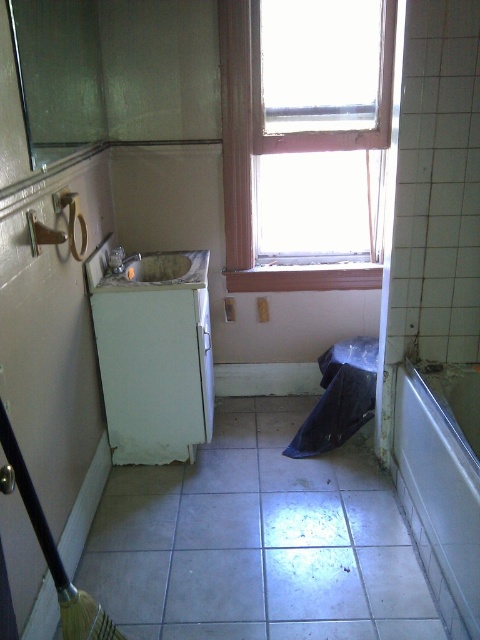
Is point (233, 32) more distant than point (118, 272)?

No, it is in front of (118, 272).

Image resolution: width=480 pixels, height=640 pixels. What do you see at coordinates (251, 172) in the screenshot? I see `transparent glass window at upper center` at bounding box center [251, 172].

You are a GUI agent. You are given a task and a screenshot of the screen. Output one action in this format:
    pyautogui.click(x=<x>, y=<y>)
    Task: Click on the transparent glass window at upper center
    
    Given the screenshot: What is the action you would take?
    pyautogui.click(x=251, y=172)

Is white glossy bathtub at lower right to the right of white glossy sink at center from the viewer's perspective?

Indeed, white glossy bathtub at lower right is positioned on the right side of white glossy sink at center.

From the picture: Does white glossy bathtub at lower right have a smaller size compared to white glossy sink at center?

No.

What do you see at coordinates (442, 483) in the screenshot?
I see `white glossy bathtub at lower right` at bounding box center [442, 483].

I want to click on white glossy bathtub at lower right, so click(x=442, y=483).

Which of these two, white glossy bathtub at lower right or transparent glass window at upper center, stands shorter?

With less height is white glossy bathtub at lower right.

Is white glossy bathtub at lower right above transparent glass window at upper center?

Incorrect, white glossy bathtub at lower right is not positioned above transparent glass window at upper center.

Does point (440, 422) come closer to viewer compared to point (232, 156)?

Yes, point (440, 422) is closer to viewer.

This screenshot has height=640, width=480. I want to click on white glossy bathtub at lower right, so click(x=442, y=483).